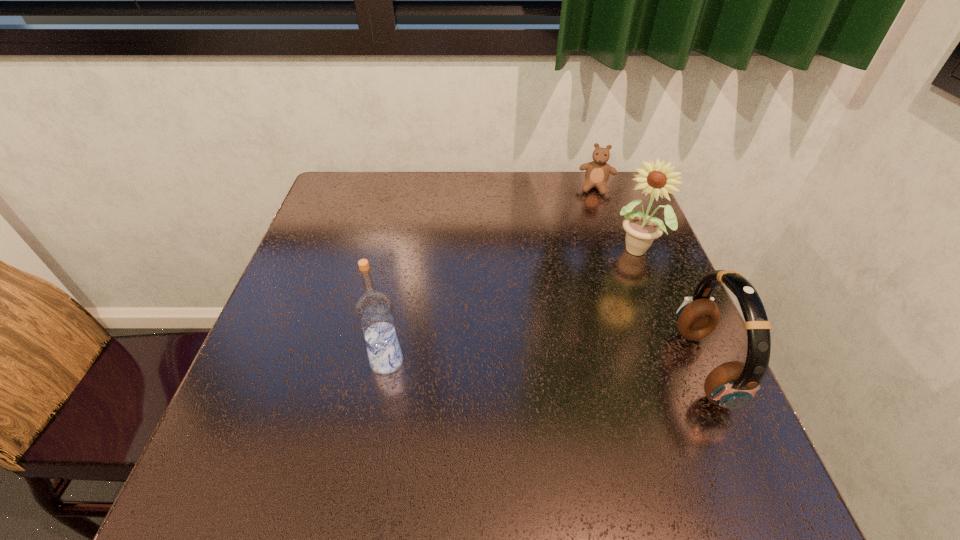
Locate an element on the screen. The height and width of the screenshot is (540, 960). free space located 0.250m on the front-facing side of the sunflower is located at coordinates (587, 337).

The image size is (960, 540). In order to click on blank area located 0.100m on the front-facing side of the sunflower in this screenshot , I will do `click(613, 294)`.

Identify the location of free space located 0.190m on the front-facing side of the shortest object. (588, 236).

Image resolution: width=960 pixels, height=540 pixels. I want to click on vacant region located 0.350m on the front-facing side of the shortest object, so click(582, 277).

Where is `free spot located on the front-facing side of the shortest object`? The image size is (960, 540). free spot located on the front-facing side of the shortest object is located at coordinates (593, 206).

Locate an element on the screen. The image size is (960, 540). object present at the far edge is located at coordinates (597, 172).

At what (x,y) coordinates should I click in order to perform the action: click on object present at the near edge. Please return your answer as a coordinate pair (x, y). Image resolution: width=960 pixels, height=540 pixels. Looking at the image, I should click on (732, 385).

The width and height of the screenshot is (960, 540). I want to click on headset at the right edge, so click(732, 385).

Where is `sunflower present at the right edge`? The width and height of the screenshot is (960, 540). sunflower present at the right edge is located at coordinates [641, 230].

Find the location of a particular element. The image size is (960, 540). teddy bear present at the right edge is located at coordinates (597, 172).